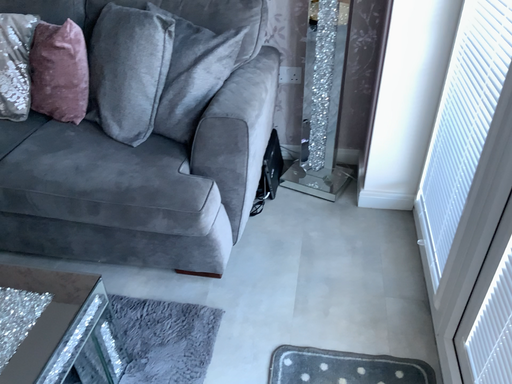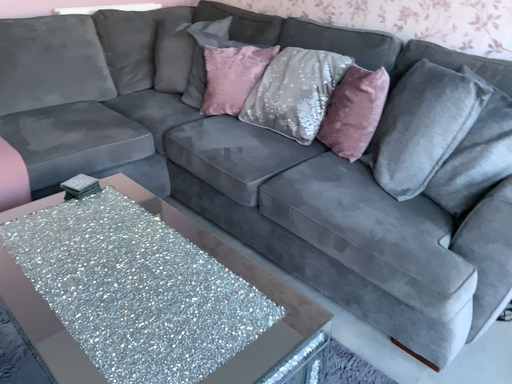
Question: How did the camera likely rotate when shooting the video?

Choices:
 (A) rotated upward
 (B) rotated downward

Answer: (A)